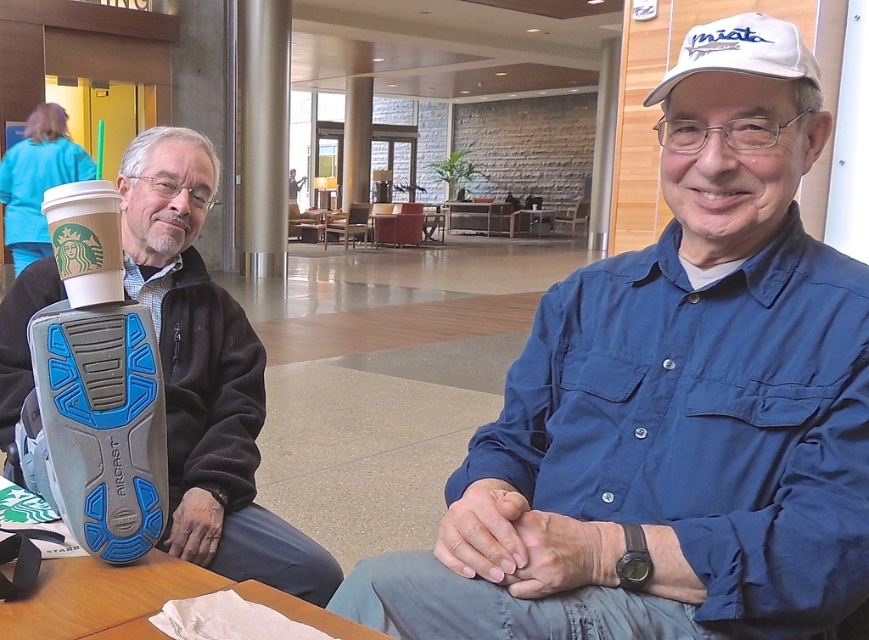
Question: Where is blue cotton shirt at center located in relation to matte black shoe at left in the image?

Choices:
 (A) left
 (B) right

Answer: (B)

Question: Is white paper cup at upper left wider than white fabric baseball cap at upper right?

Choices:
 (A) yes
 (B) no

Answer: (B)

Question: Which object appears closest to the camera in this image?

Choices:
 (A) blue cotton shirt at center
 (B) white fabric baseball cap at upper right
 (C) matte black shoe at left
 (D) white paper cup at upper left

Answer: (A)

Question: Is matte black shoe at left to the right of white fabric baseball cap at upper right from the viewer's perspective?

Choices:
 (A) yes
 (B) no

Answer: (B)

Question: Which of the following is the farthest from the observer?

Choices:
 (A) (765, 38)
 (B) (70, 227)
 (C) (599, 316)

Answer: (C)

Question: Which point is closer to the camera taking this photo?

Choices:
 (A) (76, 209)
 (B) (804, 406)
 (C) (161, 170)
 (D) (677, 68)

Answer: (B)